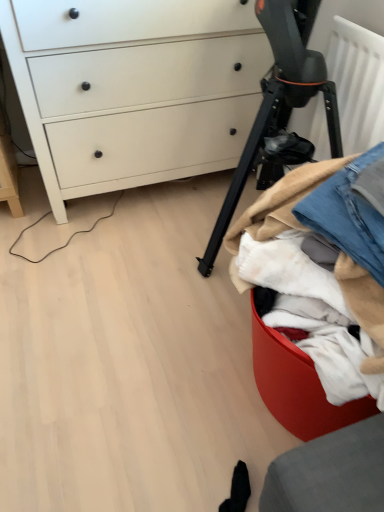
Question: Does black matte tripod at center have a larger size compared to white matte chest of drawers at upper left?

Choices:
 (A) yes
 (B) no

Answer: (B)

Question: From a real-world perspective, is black matte tripod at center under white matte chest of drawers at upper left?

Choices:
 (A) no
 (B) yes

Answer: (A)

Question: Are black matte tripod at center and white matte chest of drawers at upper left far apart?

Choices:
 (A) yes
 (B) no

Answer: (B)

Question: From the image's perspective, is black matte tripod at center located beneath white matte chest of drawers at upper left?

Choices:
 (A) no
 (B) yes

Answer: (B)

Question: Does black matte tripod at center appear on the left side of white matte chest of drawers at upper left?

Choices:
 (A) no
 (B) yes

Answer: (A)

Question: Choose the correct answer: Is black matte tripod at center inside white matte chest of drawers at upper left or outside it?

Choices:
 (A) inside
 (B) outside

Answer: (B)

Question: Is black matte tripod at center to the left or to the right of white matte chest of drawers at upper left in the image?

Choices:
 (A) left
 (B) right

Answer: (B)

Question: Looking at their shapes, would you say black matte tripod at center is wider or thinner than white matte chest of drawers at upper left?

Choices:
 (A) wide
 (B) thin

Answer: (B)

Question: Considering the positions of point (288, 23) and point (196, 57), is point (288, 23) closer or farther from the camera than point (196, 57)?

Choices:
 (A) farther
 (B) closer

Answer: (B)

Question: Does point (307, 208) appear closer or farther from the camera than point (297, 33)?

Choices:
 (A) farther
 (B) closer

Answer: (B)

Question: Would you say denim at right is to the left or to the right of black matte tripod at center in the picture?

Choices:
 (A) right
 (B) left

Answer: (A)

Question: Is denim at right in front of or behind black matte tripod at center in the image?

Choices:
 (A) behind
 (B) front

Answer: (B)

Question: From a real-world perspective, is denim at right physically located above or below black matte tripod at center?

Choices:
 (A) above
 (B) below

Answer: (A)

Question: From a real-world perspective, is white matte chest of drawers at upper left above or below black matte tripod at center?

Choices:
 (A) below
 (B) above

Answer: (A)

Question: Does point (241, 94) appear closer or farther from the camera than point (271, 86)?

Choices:
 (A) closer
 (B) farther

Answer: (B)